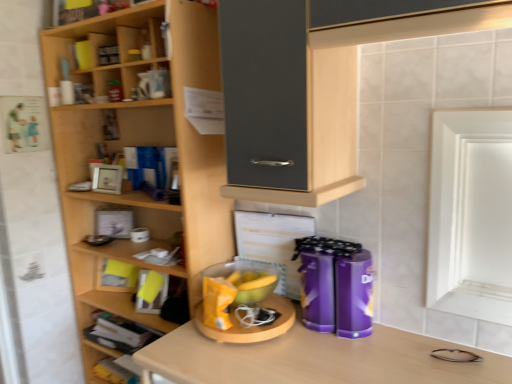
In order to click on free space underneath purple glossy canisters at center, placed as the second appliance when sorted from left to right (from a real-world perspective) in this screenshot , I will do 331,338.